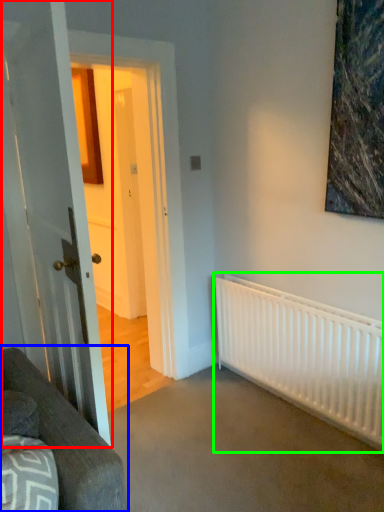
Question: Which object is positioned closest to door (highlighted by a red box)? Select from studio couch (highlighted by a blue box) and radiator (highlighted by a green box).

Choices:
 (A) studio couch
 (B) radiator

Answer: (A)